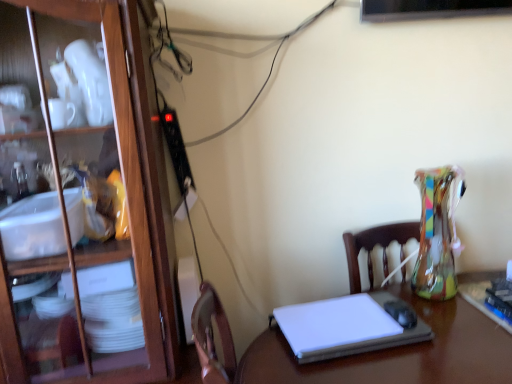
Question: Considering the relative sizes of white matte laptop at center and white glossy desk at center in the image provided, is white matte laptop at center wider than white glossy desk at center?

Choices:
 (A) yes
 (B) no

Answer: (B)

Question: From a real-world perspective, is white matte laptop at center positioned under white glossy desk at center based on gravity?

Choices:
 (A) yes
 (B) no

Answer: (B)

Question: Does white matte laptop at center have a lesser height compared to white glossy desk at center?

Choices:
 (A) yes
 (B) no

Answer: (A)

Question: Is white matte laptop at center in front of white glossy desk at center?

Choices:
 (A) yes
 (B) no

Answer: (B)

Question: Can you confirm if white matte laptop at center is positioned to the right of white glossy desk at center?

Choices:
 (A) yes
 (B) no

Answer: (A)

Question: Considering the positions of white matte laptop at center and wooden cabinet at left in the image, is white matte laptop at center wider or thinner than wooden cabinet at left?

Choices:
 (A) thin
 (B) wide

Answer: (A)

Question: From a real-world perspective, relative to wooden cabinet at left, is white matte laptop at center vertically above or below?

Choices:
 (A) above
 (B) below

Answer: (B)

Question: Is white matte laptop at center bigger or smaller than wooden cabinet at left?

Choices:
 (A) big
 (B) small

Answer: (B)

Question: Based on their positions, is white matte laptop at center located to the left or right of wooden cabinet at left?

Choices:
 (A) left
 (B) right

Answer: (B)

Question: Is wooden cabinet at left spatially inside white matte laptop at center, or outside of it?

Choices:
 (A) inside
 (B) outside

Answer: (B)

Question: Is point (144, 322) closer or farther from the camera than point (324, 347)?

Choices:
 (A) closer
 (B) farther

Answer: (B)

Question: In the image, is wooden cabinet at left positioned in front of or behind white matte laptop at center?

Choices:
 (A) behind
 (B) front

Answer: (B)

Question: Considering the positions of wooden cabinet at left and white matte laptop at center in the image, is wooden cabinet at left bigger or smaller than white matte laptop at center?

Choices:
 (A) small
 (B) big

Answer: (B)

Question: Is white glossy desk at center taller or shorter than wooden cabinet at left?

Choices:
 (A) tall
 (B) short

Answer: (B)

Question: Is white glossy desk at center in front of or behind wooden cabinet at left in the image?

Choices:
 (A) behind
 (B) front

Answer: (B)